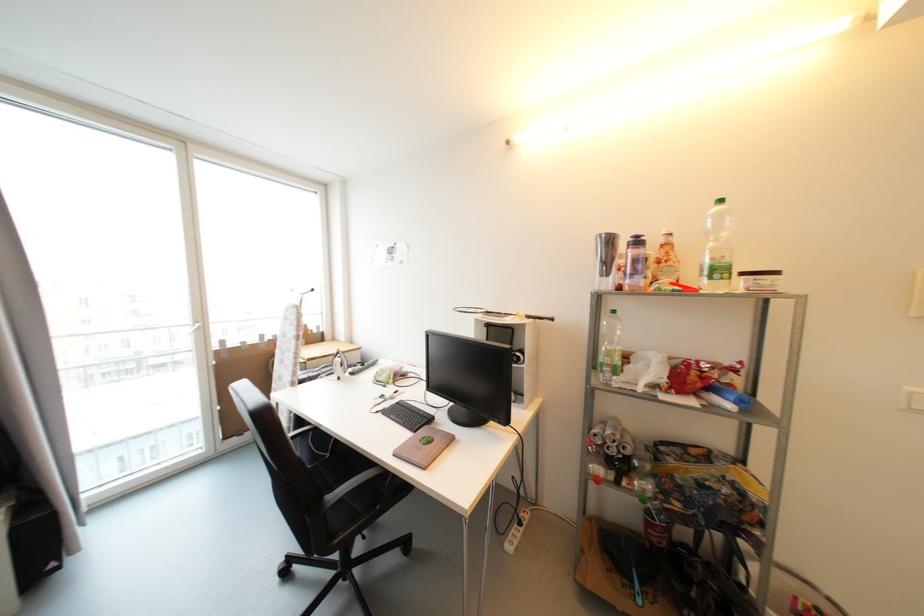
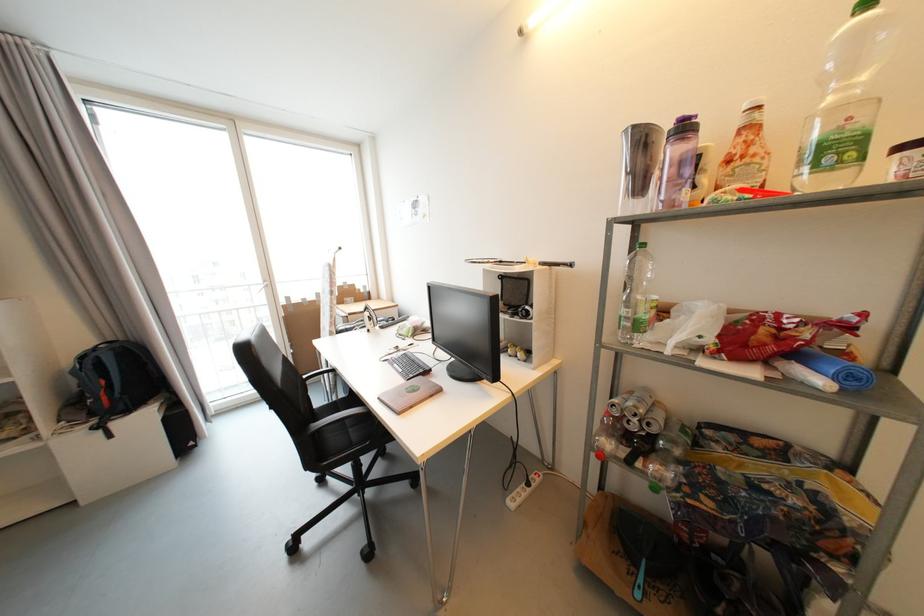
Find the pixel in the second image that matches (x=612, y=236) in the first image.

(639, 129)